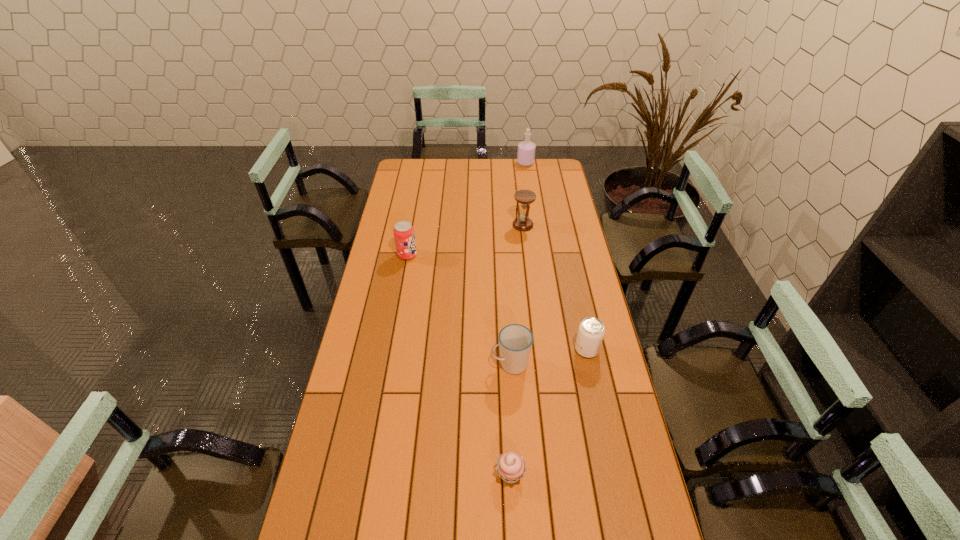
Image resolution: width=960 pixels, height=540 pixels. What are the coordinates of `free space located 0.110m on the front of the tallest object` in the screenshot? It's located at (528, 178).

Identify the location of vacant space located 0.250m on the front of the hourglass. The image size is (960, 540). (528, 269).

The image size is (960, 540). I want to click on vacant space located on the surface of the third farthest object, so click(447, 255).

You are a GUI agent. You are given a task and a screenshot of the screen. Output one action in this format:
    pyautogui.click(x=<x>, y=<y>)
    Task: Click on the free space located with a handle on the side of the cup
    This screenshot has width=960, height=540.
    Given the screenshot: What is the action you would take?
    pyautogui.click(x=402, y=364)

Find the location of a particular element. This screenshot has width=960, height=540. vacant space located 0.130m with a handle on the side of the cup is located at coordinates (453, 364).

Locate an element on the screen. Image resolution: width=960 pixels, height=540 pixels. free space located with a handle on the side of the cup is located at coordinates (474, 364).

Identify the location of vacant space located 0.080m on the left of the right soda can. The width and height of the screenshot is (960, 540). (551, 349).

I want to click on free spot located on the left of the nearest object, so click(x=469, y=474).

You are a GUI agent. You are given a task and a screenshot of the screen. Output one action in this format:
    pyautogui.click(x=<x>, y=<y>)
    Task: Click on the object present at the far edge
    This screenshot has height=540, width=960.
    Given the screenshot: What is the action you would take?
    pyautogui.click(x=526, y=149)

Find the location of `object present at the left edge`. object present at the left edge is located at coordinates (404, 235).